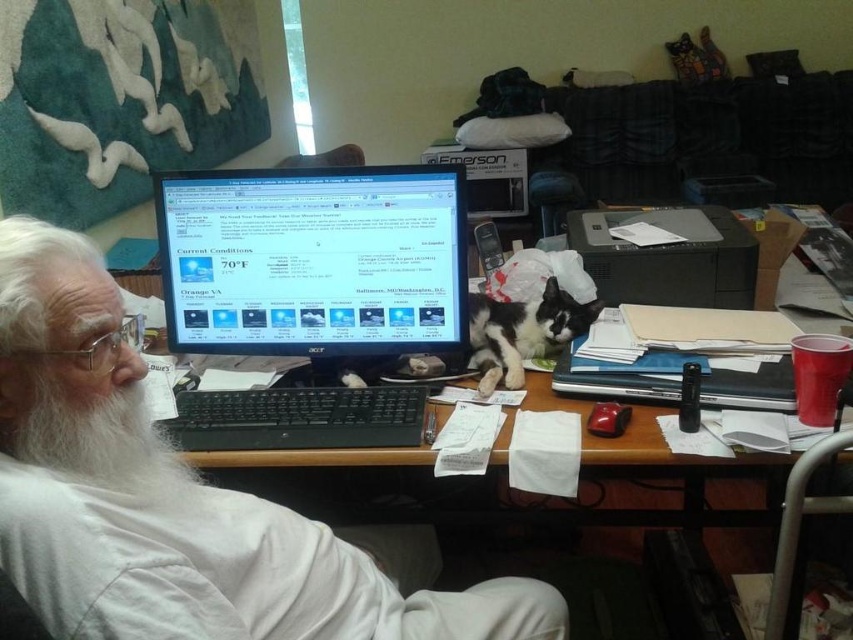
Between white cotton shirt at center and black glossy monitor at center, which one has more height?

Standing taller between the two is white cotton shirt at center.

Can you confirm if white cotton shirt at center is positioned above black glossy monitor at center?

Actually, white cotton shirt at center is below black glossy monitor at center.

Locate an element on the screen. This screenshot has height=640, width=853. white cotton shirt at center is located at coordinates pos(181,500).

Can you confirm if white cotton shirt at center is shorter than white fluffy beard at left?

No, white cotton shirt at center is not shorter than white fluffy beard at left.

Measure the distance between white cotton shirt at center and camera.

The distance of white cotton shirt at center from camera is 24.65 inches.

What do you see at coordinates (181, 500) in the screenshot?
I see `white cotton shirt at center` at bounding box center [181, 500].

Image resolution: width=853 pixels, height=640 pixels. Identify the location of white cotton shirt at center. (181, 500).

Which is in front, point (448, 186) or point (28, 435)?

Point (28, 435) is in front.

The height and width of the screenshot is (640, 853). Describe the element at coordinates (314, 260) in the screenshot. I see `black glossy monitor at center` at that location.

Who is more forward, (457, 204) or (48, 403)?

Point (48, 403) is more forward.

The width and height of the screenshot is (853, 640). I want to click on black glossy monitor at center, so click(314, 260).